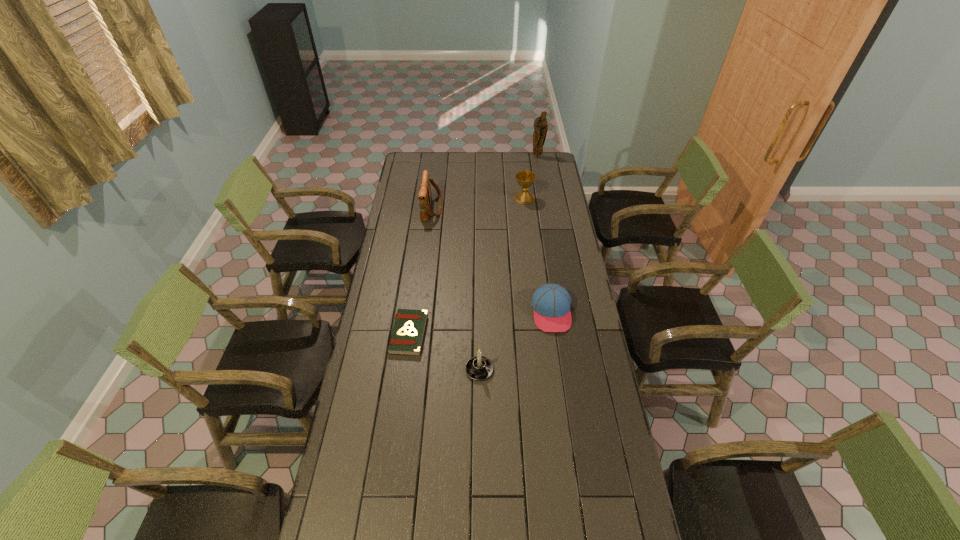
In order to click on chalice positioned at the right edge in this screenshot , I will do `click(525, 179)`.

The width and height of the screenshot is (960, 540). Find the location of `baseball cap positioned at the right edge`. baseball cap positioned at the right edge is located at coordinates (551, 302).

Identify the location of object located in the far right corner section of the desktop. This screenshot has height=540, width=960. (540, 124).

I want to click on free space at the far edge, so click(493, 171).

This screenshot has width=960, height=540. In the image, there is a desktop. Find the location of `vacant region at the left edge`. vacant region at the left edge is located at coordinates (388, 232).

Identify the location of vacant region at the right edge of the desktop. Image resolution: width=960 pixels, height=540 pixels. (584, 359).

I want to click on vacant space at the far right corner of the desktop, so click(533, 172).

This screenshot has height=540, width=960. What are the coordinates of `empty space between the chalice and the shortest object` in the screenshot? It's located at (467, 266).

Where is `free spot between the shoulder bag and the farthest object`? The height and width of the screenshot is (540, 960). free spot between the shoulder bag and the farthest object is located at coordinates (485, 183).

The width and height of the screenshot is (960, 540). What are the coordinates of `free spot between the shortest object and the second shortest object` in the screenshot? It's located at (480, 323).